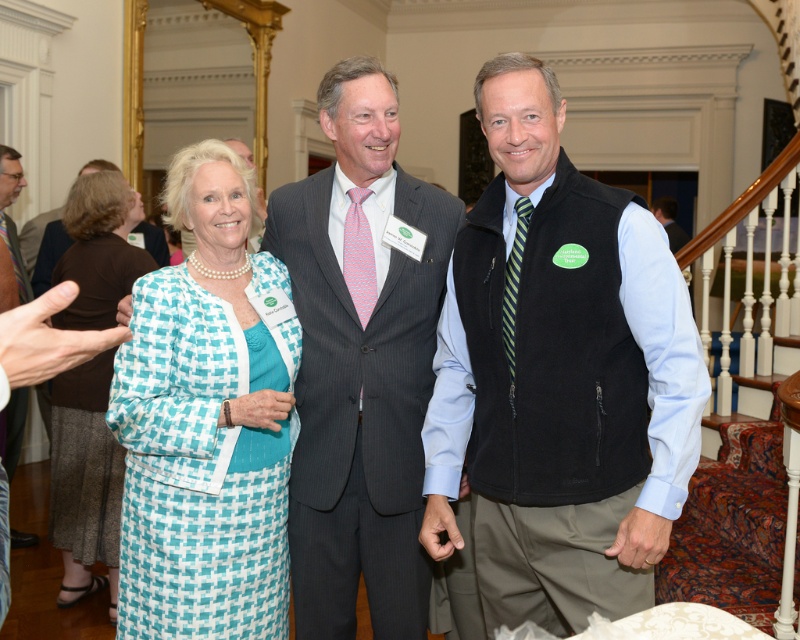
You are a photographer adjusting the camera height to ensure both the black fleece vest at center and the gray pinstripe suit at center are fully visible in the frame. Which object should you position the camera closer to in order to capture both without cropping?

The camera should be positioned closer to the black fleece vest at center since it is shorter than the gray pinstripe suit at center, allowing both to be fully visible in the frame.

You are a photographer trying to adjust the lighting for the group photo. You need to ensure that the black fleece vest at center and the teal woven dress at left are both well lit. Based on their positions, which one is closer to the right side of the frame?

The black fleece vest at center is positioned on the right side of the teal woven dress at left, so the black fleece vest at center is closer to the right side of the frame.